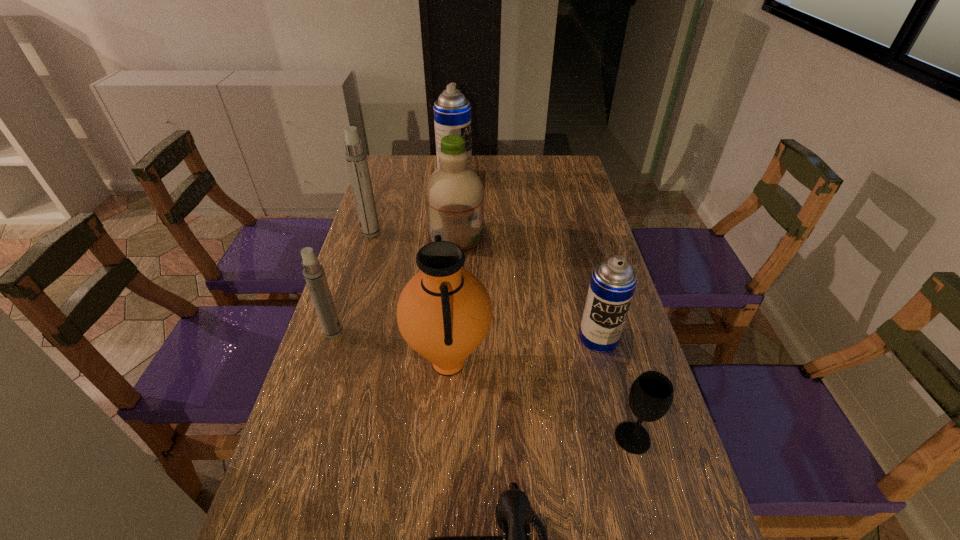
The image size is (960, 540). Identify the location of free location located on the back of the farther white aerosol can. (385, 187).

Where is `vacant space situated 0.200m on the label side of the farthest aerosol can`? This screenshot has width=960, height=540. vacant space situated 0.200m on the label side of the farthest aerosol can is located at coordinates (523, 178).

Identify the location of free location located 0.300m on the front label of the cleansing agent. Image resolution: width=960 pixels, height=540 pixels. (574, 237).

At what (x,y) coordinates should I click in order to perform the action: click on free region located on the right of the pitcher. Please return your answer as a coordinate pair (x, y). Looking at the image, I should click on (643, 362).

This screenshot has width=960, height=540. I want to click on vacant position located 0.200m on the back of the nearer white aerosol can, so click(351, 275).

Locate an element on the screen. The height and width of the screenshot is (540, 960). vacant space located on the label side of the right blue aerosol can is located at coordinates (614, 400).

What are the coordinates of `vacant space positioned 0.400m on the left of the wineglass` in the screenshot? It's located at tap(424, 438).

At what (x,y) coordinates should I click in order to perform the action: click on object that is at the far edge. Please return your answer as a coordinate pair (x, y). This screenshot has height=540, width=960. Looking at the image, I should click on (452, 111).

You are a GUI agent. You are given a task and a screenshot of the screen. Output one action in this format:
    pyautogui.click(x=<x>, y=<y>)
    Task: Click on the aerosol can located in the right edge section of the desktop
    
    Given the screenshot: What is the action you would take?
    pyautogui.click(x=613, y=281)

The width and height of the screenshot is (960, 540). Find the location of `wineglass at the right edge`. wineglass at the right edge is located at coordinates (651, 395).